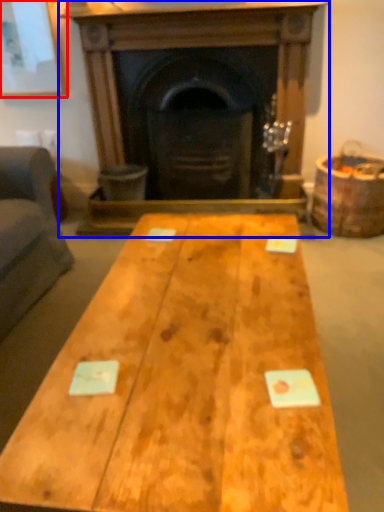
Question: Which object is closer to the camera taking this photo, picture frame (highlighted by a red box) or fireplace (highlighted by a blue box)?

Choices:
 (A) picture frame
 (B) fireplace

Answer: (B)